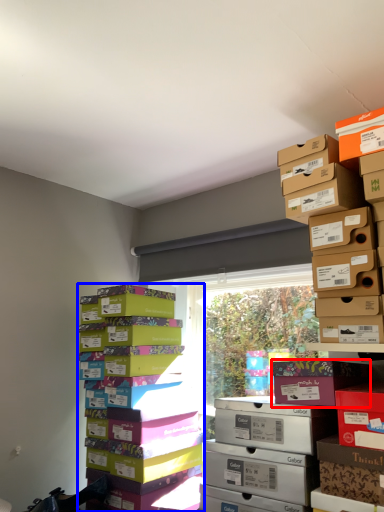
Question: Which point is further to the camera, cardboard box (highlighted by a red box) or package (highlighted by a blue box)?

Choices:
 (A) cardboard box
 (B) package

Answer: (B)